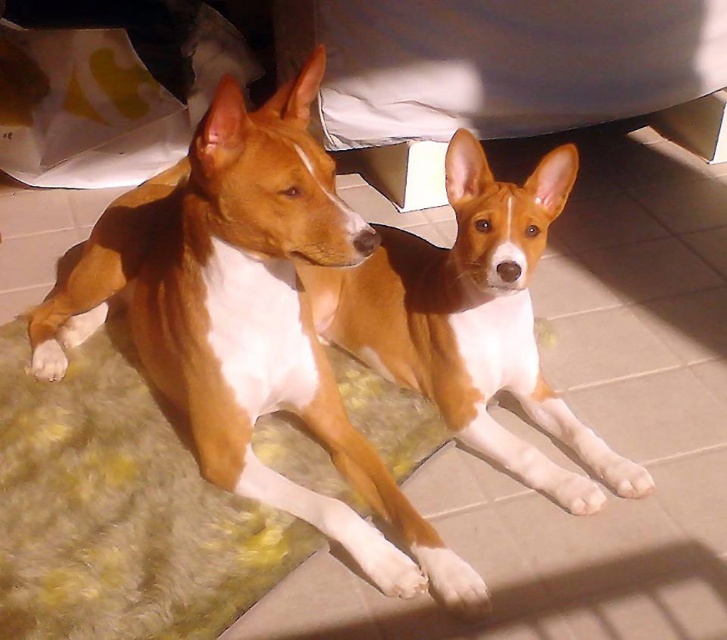
Who is higher up, brown shiny fur dog at center or brown/white fur at center?

brown shiny fur dog at center is higher up.

Is brown shiny fur dog at center wider than brown/white fur at center?

Yes, brown shiny fur dog at center is wider than brown/white fur at center.

Identify the location of brown shiny fur dog at center. (246, 320).

Can you confirm if yellow fuzzy mat at lower left is thinner than brown/white fur at center?

No.

Locate an element on the screen. This screenshot has height=640, width=727. yellow fuzzy mat at lower left is located at coordinates (119, 509).

Is point (166, 557) positioned before point (467, 330)?

Yes, point (166, 557) is in front of point (467, 330).

Locate an element on the screen. Image resolution: width=727 pixels, height=640 pixels. yellow fuzzy mat at lower left is located at coordinates (119, 509).

Is brown shiny fur dog at center to the right of yellow fuzzy mat at lower left from the viewer's perspective?

Indeed, brown shiny fur dog at center is positioned on the right side of yellow fuzzy mat at lower left.

How far apart are brown shiny fur dog at center and yellow fuzzy mat at lower left?

They are 7.67 inches apart.

Is point (108, 221) more distant than point (92, 465)?

Yes.

I want to click on brown shiny fur dog at center, so click(246, 320).